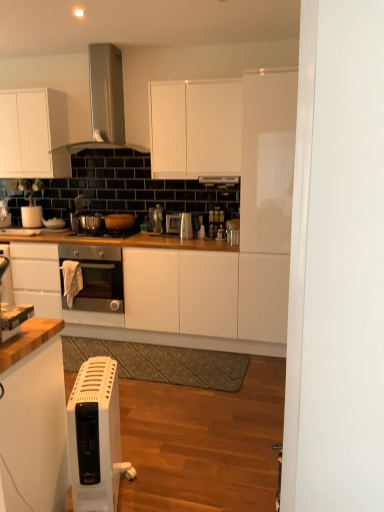
In order to face shiny metallic gas stove at center, should I rotate leftwards or rightwards?

Turn left approximately 11.559 degrees to face it.

What do you see at coordinates (90, 221) in the screenshot? I see `metallic silver pot at center, arranged as the sixth appliance when viewed from the right` at bounding box center [90, 221].

Locate an element on the screen. Image resolution: width=384 pixels, height=512 pixels. satin silver range hood at upper center is located at coordinates (105, 96).

Identify the location of satin silver kettle at center, the seventh appliance from the left. [186, 226].

The width and height of the screenshot is (384, 512). What do you see at coordinates (186, 226) in the screenshot?
I see `satin silver kettle at center, which ranks as the second appliance in front-to-back order` at bounding box center [186, 226].

The image size is (384, 512). I want to click on shiny metallic gas stove at center, so click(106, 233).

Which of these two, matte brown pot at center, placed as the 4th appliance when sorted from back to front, or satin silver toaster at center, which is counted as the fifth appliance, starting from the left, is bigger?

With larger size is matte brown pot at center, placed as the 4th appliance when sorted from back to front.

Is matte brown pot at center, arranged as the fourth appliance when viewed from the left, directly adjacent to satin silver toaster at center, which ranks as the 5th appliance in front-to-back order?

No, matte brown pot at center, arranged as the fourth appliance when viewed from the left, is not beside satin silver toaster at center, which ranks as the 5th appliance in front-to-back order.

Is matte brown pot at center, acting as the 4th appliance starting from the front, aimed at satin silver toaster at center, placed as the 3th appliance when sorted from back to front?

No.

From a real-world perspective, who is located lower, matte brown pot at center, which is the fourth appliance from right to left, or satin silver toaster at center, which ranks as the 5th appliance in front-to-back order?

matte brown pot at center, which is the fourth appliance from right to left.

Which of these two, matte brown pot at center, which is the fourth appliance from right to left, or satin silver kettle at center, which ranks as the second appliance in front-to-back order, is thinner?

With smaller width is satin silver kettle at center, which ranks as the second appliance in front-to-back order.

Considering the positions of objects matte brown pot at center, which is the fourth appliance from right to left, and satin silver kettle at center, marked as the 6th appliance in a back-to-front arrangement, in the image provided, who is more to the left, matte brown pot at center, which is the fourth appliance from right to left, or satin silver kettle at center, marked as the 6th appliance in a back-to-front arrangement,?

matte brown pot at center, which is the fourth appliance from right to left, is more to the left.

Looking at this image, between metallic silver pot at center, marked as the 2th appliance in a back-to-front arrangement, and shiny metallic gas stove at center, which one has smaller size?

With smaller size is metallic silver pot at center, marked as the 2th appliance in a back-to-front arrangement.

From a real-world perspective, is metallic silver pot at center, marked as the 2th appliance in a back-to-front arrangement, under shiny metallic gas stove at center?

No, from a real-world perspective, metallic silver pot at center, marked as the 2th appliance in a back-to-front arrangement, is not beneath shiny metallic gas stove at center.

Is metallic silver pot at center, marked as the 2th appliance in a back-to-front arrangement, wider or thinner than shiny metallic gas stove at center?

metallic silver pot at center, marked as the 2th appliance in a back-to-front arrangement, is thinner than shiny metallic gas stove at center.

Which appliance is the 6th one when counting from the right side of the white matte paper towel holder at left, the first appliance in the left-to-right sequence? Please provide its 2D coordinates.

[(186, 226)]

Looking at this image, considering the sizes of objects white matte paper towel holder at left, the first appliance in the left-to-right sequence, and satin silver kettle at center, marked as the 6th appliance in a back-to-front arrangement, in the image provided, who is bigger, white matte paper towel holder at left, the first appliance in the left-to-right sequence, or satin silver kettle at center, marked as the 6th appliance in a back-to-front arrangement,?

With larger size is white matte paper towel holder at left, the first appliance in the left-to-right sequence.

Considering the points (29, 211) and (184, 219), which point is behind, point (29, 211) or point (184, 219)?

Positioned behind is point (29, 211).

Which is behind, white matte paper towel holder at left, marked as the first appliance in a back-to-front arrangement, or satin silver kettle at center, the seventh appliance from the left?

white matte paper towel holder at left, marked as the first appliance in a back-to-front arrangement.

Is satin silver toaster at center, which ranks as the 5th appliance in front-to-back order, a part of white matte paper towel holder at left, which is the seventh appliance in front-to-back order?

No, white matte paper towel holder at left, which is the seventh appliance in front-to-back order, does not contain satin silver toaster at center, which ranks as the 5th appliance in front-to-back order.

From a real-world perspective, is white matte paper towel holder at left, which is the seventh appliance in front-to-back order, above or below satin silver toaster at center, which ranks as the 5th appliance in front-to-back order?

In terms of real-world spatial position, white matte paper towel holder at left, which is the seventh appliance in front-to-back order, is above satin silver toaster at center, which ranks as the 5th appliance in front-to-back order.

From the image's perspective, is white matte paper towel holder at left, the first appliance in the left-to-right sequence, on top of satin silver toaster at center, which is counted as the fifth appliance, starting from the left?

Yes, from the image's perspective, white matte paper towel holder at left, the first appliance in the left-to-right sequence, is over satin silver toaster at center, which is counted as the fifth appliance, starting from the left.

Which object is closer to the camera, white matte paper towel holder at left, which is the seventh appliance in front-to-back order, or satin silver toaster at center, the 3th appliance from the right?

satin silver toaster at center, the 3th appliance from the right.

Is point (56, 99) closer or farther from the camera than point (122, 228)?

Point (56, 99) is closer to the camera than point (122, 228).

From a real-world perspective, starting from the white matte cabinet at upper left, the 2th cabinetry viewed from the right, which appliance is the 3rd one below it? Please provide its 2D coordinates.

[(119, 221)]

Is white matte cabinet at upper left, arranged as the first cabinetry when viewed from the left, turned away from matte brown pot at center, acting as the 4th appliance starting from the front?

white matte cabinet at upper left, arranged as the first cabinetry when viewed from the left, is not turned away from matte brown pot at center, acting as the 4th appliance starting from the front.

How many degrees apart are the facing directions of matte brown pot at center, placed as the 4th appliance when sorted from back to front, and metallic silver pot at center, marked as the 2th appliance in a back-to-front arrangement?

The facing directions of matte brown pot at center, placed as the 4th appliance when sorted from back to front, and metallic silver pot at center, marked as the 2th appliance in a back-to-front arrangement, are 3.55 degrees apart.

Are matte brown pot at center, acting as the 4th appliance starting from the front, and metallic silver pot at center, the 2th appliance in the left-to-right sequence, located far from each other?

No.

In terms of width, does matte brown pot at center, arranged as the fourth appliance when viewed from the left, look wider or thinner when compared to metallic silver pot at center, which ranks as the sixth appliance in front-to-back order?

Clearly, matte brown pot at center, arranged as the fourth appliance when viewed from the left, has more width compared to metallic silver pot at center, which ranks as the sixth appliance in front-to-back order.

Starting from the metallic silver pot at center, the 2th appliance in the left-to-right sequence, which appliance is the 2nd one in front? Please provide its 2D coordinates.

[(119, 221)]

From the image's perspective, count 2nd appliances downward from the satin silver toaster at center, the 3th appliance from the right, and point to it. Please provide its 2D coordinates.

[(119, 221)]

From the image's perspective, count 2nd appliances upward from the satin silver kettle at center, which ranks as the second appliance in front-to-back order, and point to it. Please provide its 2D coordinates.

[(119, 221)]

Looking at the image, which one is located closer to white matte cabinet at upper center, the 2th cabinetry positioned from the left, white plastic toaster at lower left, acting as the 1th appliance starting from the front, or satin silver kettle at center, marked as the 6th appliance in a back-to-front arrangement?

satin silver kettle at center, marked as the 6th appliance in a back-to-front arrangement, is positioned closer to the anchor white matte cabinet at upper center, the 2th cabinetry positioned from the left.

Estimate the real-world distances between objects in this image. Which object is further from satin silver toaster at center, which is counted as the fifth appliance, starting from the left, satin silver kettle at center, the seventh appliance from the left, or white plastic heater at lower left?

white plastic heater at lower left is positioned further to the anchor satin silver toaster at center, which is counted as the fifth appliance, starting from the left.

From the picture: From the image, which object appears to be farther from satin silver toaster at center, which ranks as the 5th appliance in front-to-back order, satin black oven at center or white plastic heater at lower left?

white plastic heater at lower left lies further to satin silver toaster at center, which ranks as the 5th appliance in front-to-back order, than the other object.

When comparing their distances from shiny metallic gas stove at center, does white matte paper towel holder at left, marked as the first appliance in a back-to-front arrangement, or white plastic toaster at lower left, acting as the 1th appliance starting from the front, seem closer?

white matte paper towel holder at left, marked as the first appliance in a back-to-front arrangement, lies closer to shiny metallic gas stove at center than the other object.

From the image, which object appears to be farther from satin silver toaster at center, the 3th appliance from the right, metallic silver pot at center, marked as the 2th appliance in a back-to-front arrangement, or matte brown pot at center, arranged as the fourth appliance when viewed from the left?

metallic silver pot at center, marked as the 2th appliance in a back-to-front arrangement, is further to satin silver toaster at center, the 3th appliance from the right.

In the scene shown: Based on their spatial positions, is white matte paper towel holder at left, marked as the first appliance in a back-to-front arrangement, or metallic silver pot at center, which ranks as the sixth appliance in front-to-back order, further from matte brown pot at center, placed as the 4th appliance when sorted from back to front?

white matte paper towel holder at left, marked as the first appliance in a back-to-front arrangement, lies further to matte brown pot at center, placed as the 4th appliance when sorted from back to front, than the other object.

From the image, which object appears to be nearer to satin silver range hood at upper center, satin silver toaster at center, the 3th appliance from the right, or matte brown pot at center, acting as the 4th appliance starting from the front?

The object closer to satin silver range hood at upper center is matte brown pot at center, acting as the 4th appliance starting from the front.

Considering their positions, is white matte cabinet at upper left, the 2th cabinetry viewed from the right, positioned further to white matte cabinet at upper center, positioned as the first cabinetry in right-to-left order, than satin silver kettle at center, which ranks as the second appliance in front-to-back order?

white matte cabinet at upper left, the 2th cabinetry viewed from the right.

Find the location of a particular element. kitchen appliance positioned between white plastic heater at lower left and metallic silver pot at center, arranged as the sixth appliance when viewed from the right, from near to far is located at coordinates (105, 96).

You are a GUI agent. You are given a task and a screenshot of the screen. Output one action in this format:
    pyautogui.click(x=<x>, y=<y>)
    Task: Click on the kitchen appliance located between white plastic toaster at lower left, acting as the 1th appliance starting from the front, and metallic silver pot at center, which ranks as the sixth appliance in front-to-back order, in the depth direction
    The image size is (384, 512).
    Given the screenshot: What is the action you would take?
    (105, 96)

This screenshot has width=384, height=512. Find the location of `gas stove between white matte paper towel holder at left, the first appliance in the left-to-right sequence, and satin silver kettle at center, which ranks as the second appliance in front-to-back order, in the horizontal direction`. gas stove between white matte paper towel holder at left, the first appliance in the left-to-right sequence, and satin silver kettle at center, which ranks as the second appliance in front-to-back order, in the horizontal direction is located at coordinates (106, 233).

The image size is (384, 512). Identify the location of cabinetry between white plastic heater at lower left and shiny metallic gas stove at center along the z-axis. (195, 128).